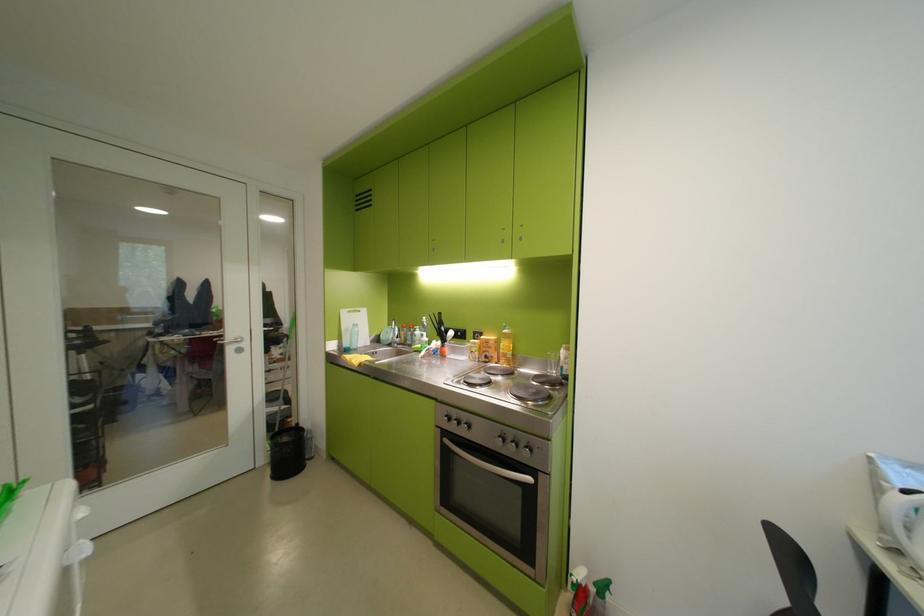
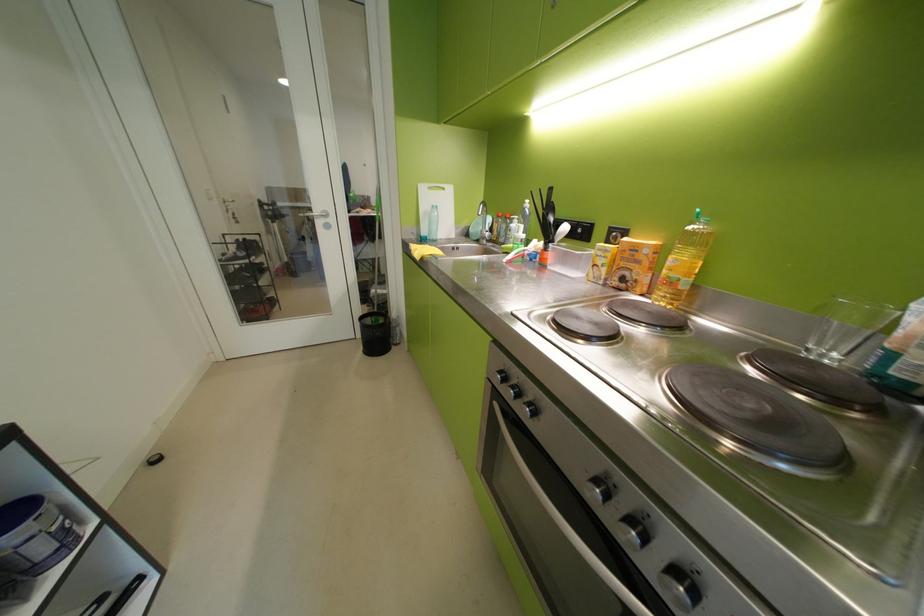
Find the pixel in the second image that matches pixel 564 373 in the first image.

(843, 358)